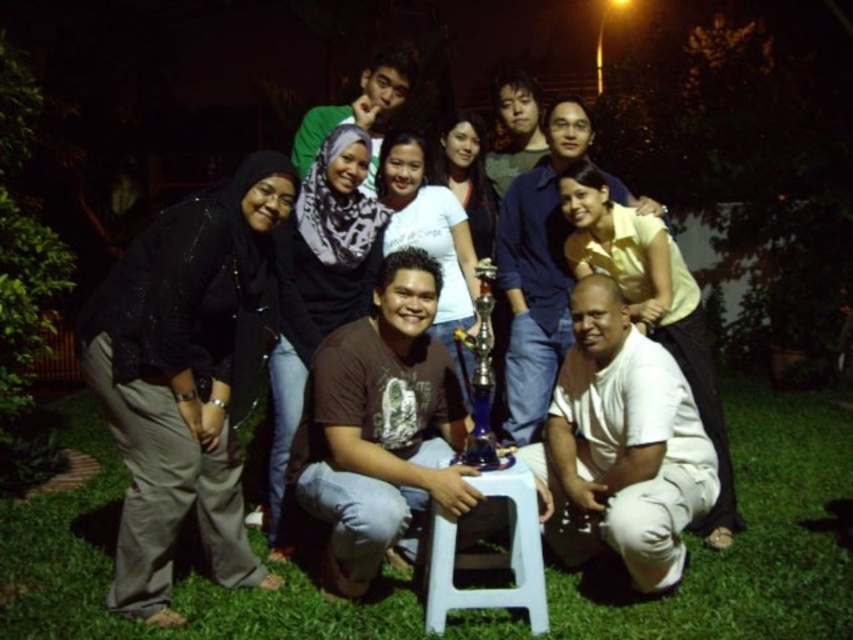
You are a photographer standing in front of the group. You want to focus your camera on the white plastic stool at center without blurring the white cotton shirt at lower right. Is this possible?

The white cotton shirt at lower right is closer to the viewer than the white plastic stool at center, so focusing on the stool may cause the shirt to be out of focus. Adjust the camera settings to ensure both are in focus.

Looking at this image, you are a photographer trying to adjust the lighting for the group photo. You notice the black matte pants at left and the white cotton shirt at lower right are in the frame. Which clothing item is located to the left of the other?

The black matte pants at left is positioned on the left side of white cotton shirt at lower right.

You are a photographer trying to focus on the white plastic stool at center for a closeup shot. However, there is a white cotton shirt at lower right in the way. Can you adjust your camera angle to capture the stool without the shirt blocking it?

The white cotton shirt at lower right is located above the white plastic stool at center, so lowering the camera angle might allow you to capture the stool without the shirt blocking it.